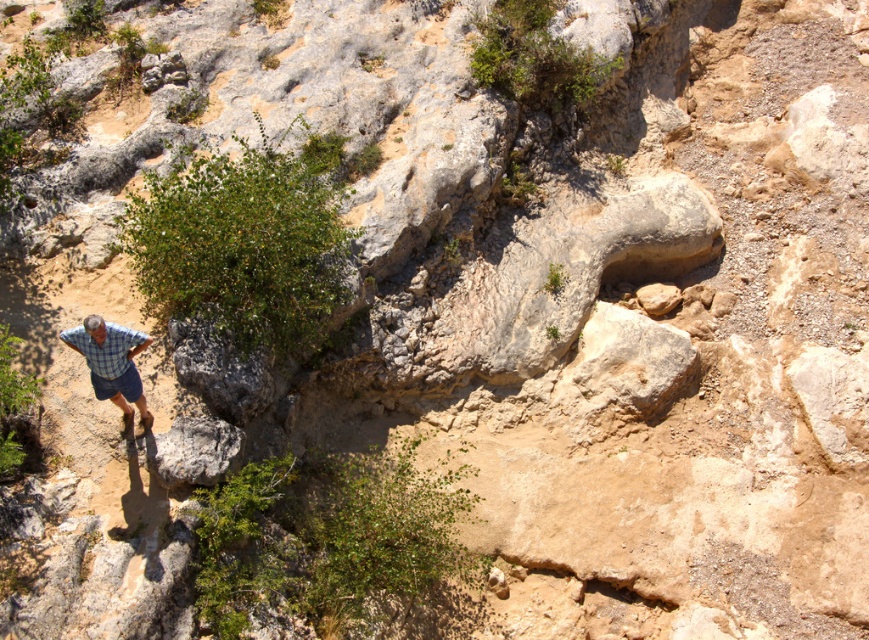
You are a hiker trying to navigate this rocky terrain. You notice the checkered fabric hiker at lower left and the blue plaid shorts at lower left. Which clothing item is positioned closer to you?

The checkered fabric hiker at lower left is closer to the viewer than the blue plaid shorts at lower left.

You are a hiker trying to navigate the rocky terrain. You see a gray rough rock at lower left and a checkered fabric hiker at lower left. Which object is smaller in size?

The gray rough rock at lower left is smaller in size compared to the checkered fabric hiker at lower left according to the description.